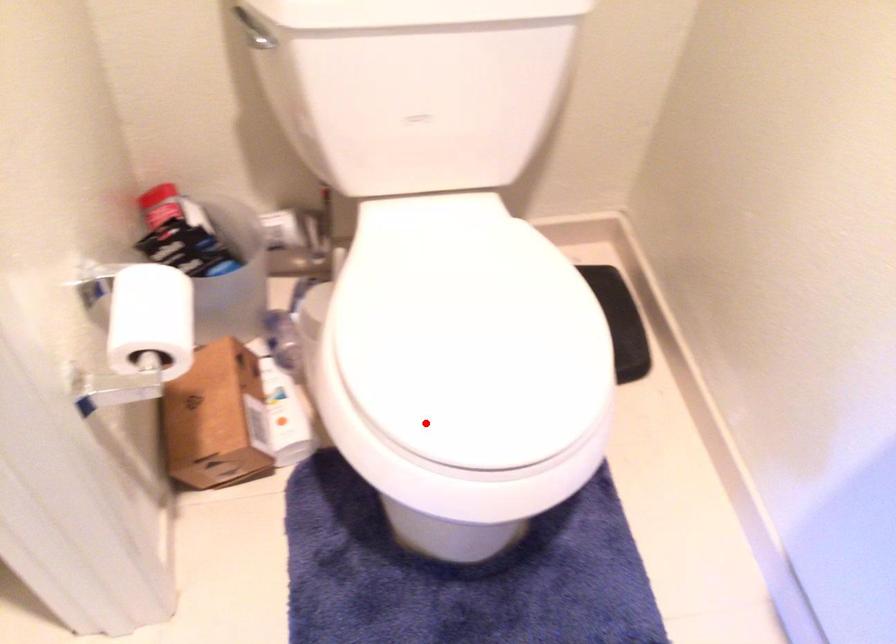
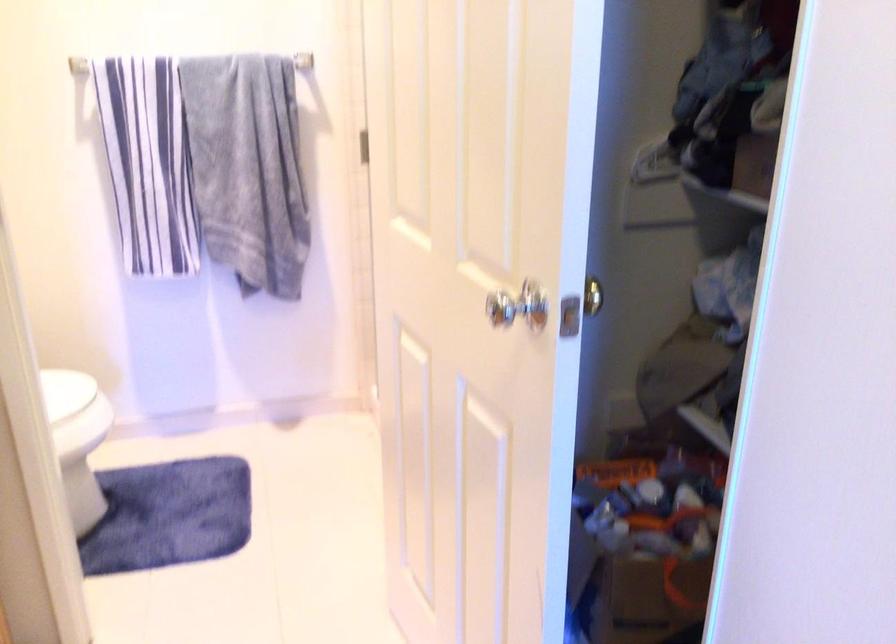
Question: I am providing you with two images of the same scene from different viewpoints. A red point is shown in image1. For the corresponding object point in image2, is it positioned nearer or farther from the camera?

Choices:
 (A) Nearer
 (B) Farther

Answer: (B)